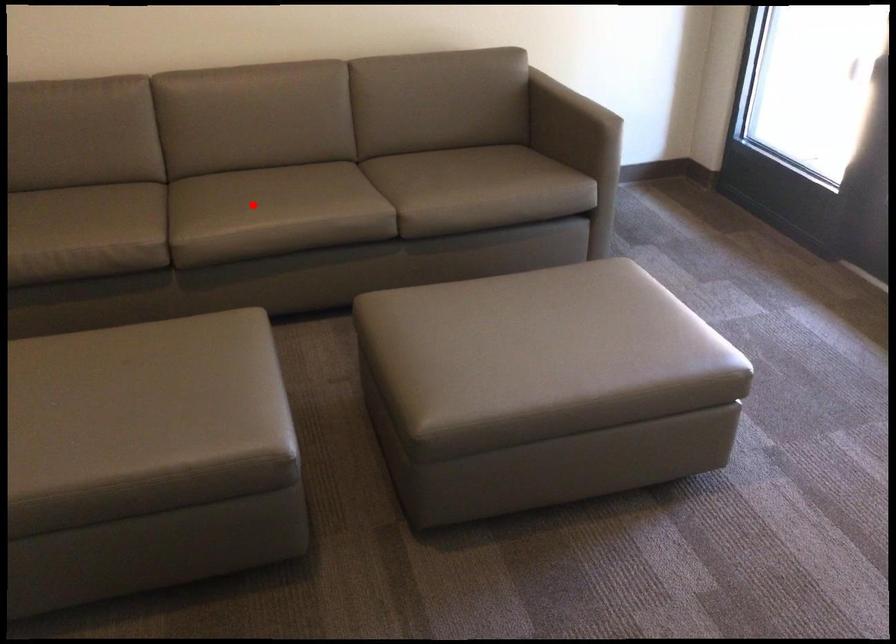
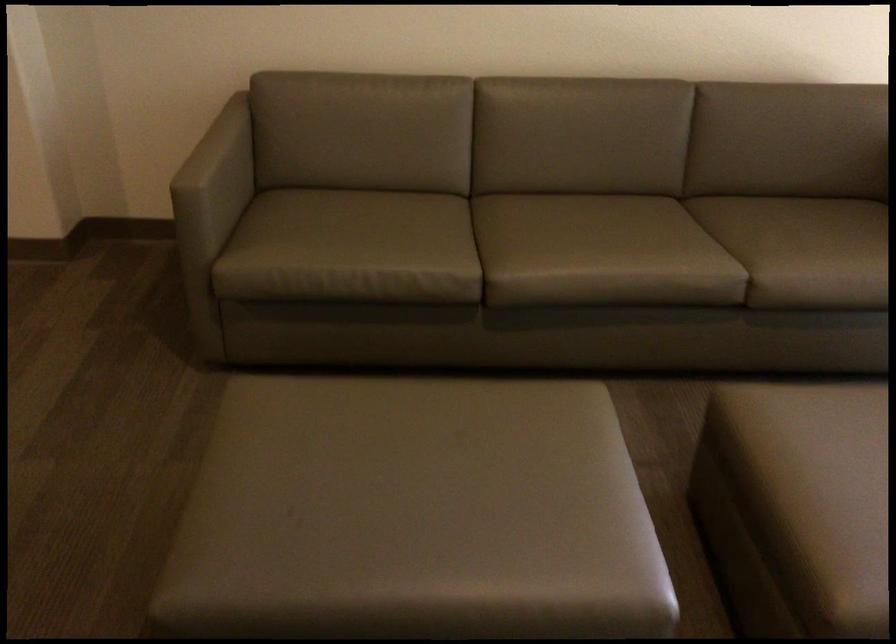
In the second image, find the point that corresponds to the highlighted location in the first image.

(583, 247)